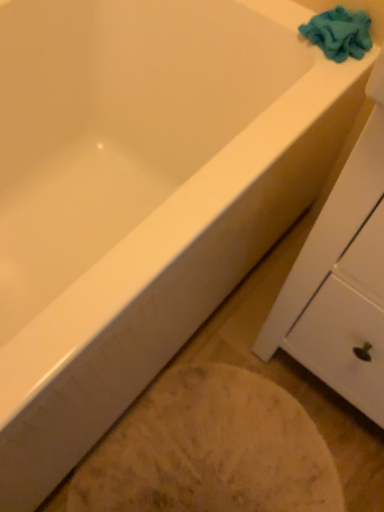
The width and height of the screenshot is (384, 512). Describe the element at coordinates (339, 33) in the screenshot. I see `blue fuzzy towel at upper right` at that location.

Locate an element on the screen. This screenshot has width=384, height=512. white glossy bathtub at lower left is located at coordinates (210, 451).

Where is `blue fuzzy towel at upper right`? The height and width of the screenshot is (512, 384). blue fuzzy towel at upper right is located at coordinates (339, 33).

From a real-world perspective, is white glossy bathtub at lower left below blue fuzzy towel at upper right?

Indeed, from a real-world perspective, white glossy bathtub at lower left is positioned beneath blue fuzzy towel at upper right.

Based on their sizes in the image, would you say white glossy bathtub at lower left is bigger or smaller than blue fuzzy towel at upper right?

Considering their sizes, white glossy bathtub at lower left takes up more space than blue fuzzy towel at upper right.

The width and height of the screenshot is (384, 512). I want to click on bath towel behind the white glossy bathtub at lower left, so click(339, 33).

Is white glossy bathtub at lower left facing towards white matte cabinet at upper right?

No, white glossy bathtub at lower left is not turned towards white matte cabinet at upper right.

Is white glossy bathtub at lower left inside the boundaries of white matte cabinet at upper right, or outside?

white glossy bathtub at lower left lies outside white matte cabinet at upper right.

Locate an element on the screen. Image resolution: width=384 pixels, height=512 pixels. porcelain behind the white matte cabinet at upper right is located at coordinates (210, 451).

Does blue fuzzy towel at upper right come behind white glossy bathtub at lower left?

Yes, it is behind white glossy bathtub at lower left.

How much distance is there between blue fuzzy towel at upper right and white glossy bathtub at lower left?

They are 33.81 inches apart.

Find the location of a particular element. This screenshot has height=512, width=384. bath towel above the white glossy bathtub at lower left (from a real-world perspective) is located at coordinates (339, 33).

Between blue fuzzy towel at upper right and white glossy bathtub at lower left, which one has smaller size?

Smaller between the two is blue fuzzy towel at upper right.

Considering the relative sizes of white matte cabinet at upper right and blue fuzzy towel at upper right in the image provided, is white matte cabinet at upper right smaller than blue fuzzy towel at upper right?

Actually, white matte cabinet at upper right might be larger than blue fuzzy towel at upper right.

Are white matte cabinet at upper right and blue fuzzy towel at upper right making contact?

They are not placed beside each other.

Is point (381, 375) positioned after point (312, 30)?

No, it is not.

Can you confirm if white matte cabinet at upper right is thinner than blue fuzzy towel at upper right?

Incorrect, the width of white matte cabinet at upper right is not less than that of blue fuzzy towel at upper right.

From the image's perspective, is white matte cabinet at upper right located above white glossy bathtub at lower left?

Yes, from the image's perspective, white matte cabinet at upper right is over white glossy bathtub at lower left.

Is point (345, 302) farther from camera compared to point (226, 432)?

No, it is in front of (226, 432).

Between white matte cabinet at upper right and white glossy bathtub at lower left, which one has smaller size?

Smaller between the two is white glossy bathtub at lower left.

Does blue fuzzy towel at upper right contain white matte cabinet at upper right?

That's incorrect, white matte cabinet at upper right is not inside blue fuzzy towel at upper right.

In terms of height, does blue fuzzy towel at upper right look taller or shorter compared to white matte cabinet at upper right?

Clearly, blue fuzzy towel at upper right is shorter compared to white matte cabinet at upper right.

Considering the sizes of blue fuzzy towel at upper right and white matte cabinet at upper right in the image, is blue fuzzy towel at upper right bigger or smaller than white matte cabinet at upper right?

Considering their sizes, blue fuzzy towel at upper right takes up less space than white matte cabinet at upper right.

Considering the points (355, 18) and (305, 294), which point is in front, point (355, 18) or point (305, 294)?

Positioned in front is point (305, 294).

Find the location of a particular element. porcelain below the blue fuzzy towel at upper right (from the image's perspective) is located at coordinates (210, 451).

The height and width of the screenshot is (512, 384). Identify the location of cabinetry in front of the white glossy bathtub at lower left. (338, 280).

Which object lies further to the anchor point blue fuzzy towel at upper right, white matte cabinet at upper right or white glossy bathtub at lower left?

white glossy bathtub at lower left.

Estimate the real-world distances between objects in this image. Which object is closer to white matte cabinet at upper right, white glossy bathtub at lower left or blue fuzzy towel at upper right?

The object closer to white matte cabinet at upper right is white glossy bathtub at lower left.

When comparing their distances from white glossy bathtub at lower left, does blue fuzzy towel at upper right or white matte cabinet at upper right seem closer?

white matte cabinet at upper right lies closer to white glossy bathtub at lower left than the other object.

From the image, which object appears to be farther from blue fuzzy towel at upper right, white glossy bathtub at lower left or white matte cabinet at upper right?

white glossy bathtub at lower left lies further to blue fuzzy towel at upper right than the other object.

Which object lies further to the anchor point white glossy bathtub at lower left, white matte cabinet at upper right or blue fuzzy towel at upper right?

blue fuzzy towel at upper right.

When comparing their distances from white matte cabinet at upper right, does blue fuzzy towel at upper right or white glossy bathtub at lower left seem further?

blue fuzzy towel at upper right.

You are a GUI agent. You are given a task and a screenshot of the screen. Output one action in this format:
    pyautogui.click(x=<x>, y=<y>)
    Task: Click on the cabinetry between blue fuzzy towel at upper right and white glossy bathtub at lower left in the vertical direction
    The height and width of the screenshot is (512, 384).
    Given the screenshot: What is the action you would take?
    [x=338, y=280]